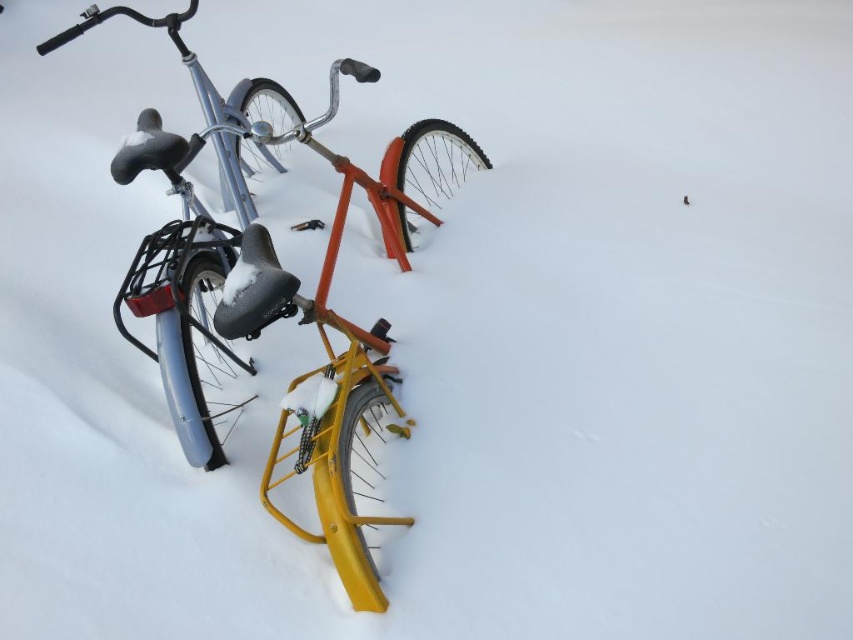
Question: Which point is closer to the camera?

Choices:
 (A) (309, 456)
 (B) (132, 12)

Answer: (A)

Question: Is yellow matte bicycle at center positioned before matte blue bicycle at left?

Choices:
 (A) yes
 (B) no

Answer: (A)

Question: Is yellow matte bicycle at center positioned in front of matte blue bicycle at left?

Choices:
 (A) yes
 (B) no

Answer: (A)

Question: From the image, what is the correct spatial relationship of yellow matte bicycle at center in relation to matte blue bicycle at left?

Choices:
 (A) left
 (B) right

Answer: (B)

Question: Among these objects, which one is nearest to the camera?

Choices:
 (A) yellow matte bicycle at center
 (B) matte blue bicycle at left

Answer: (A)